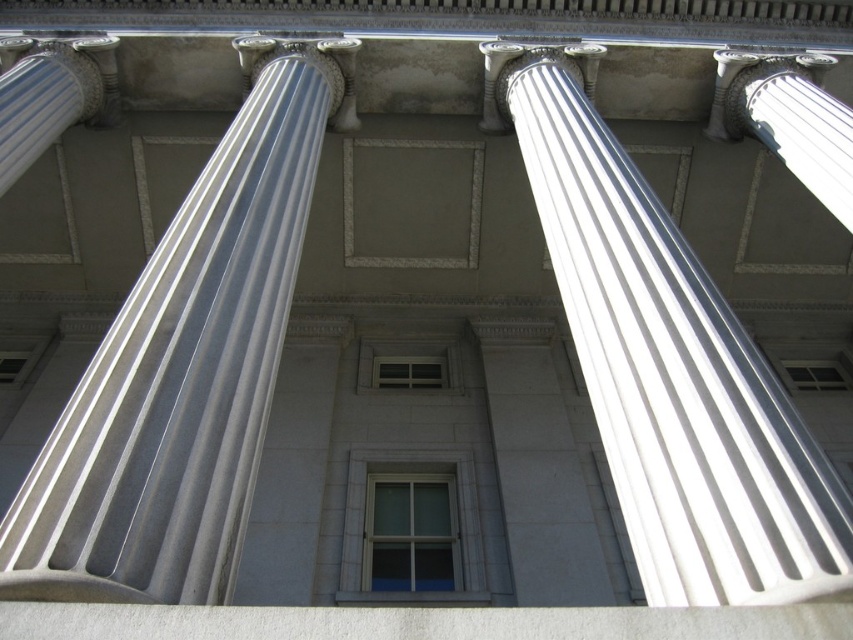
Question: Which object appears closest to the camera in this image?

Choices:
 (A) white glossy column at center
 (B) white marble column at upper right
 (C) white marble column at center

Answer: (A)

Question: Is white glossy column at center wider than white marble column at center?

Choices:
 (A) no
 (B) yes

Answer: (B)

Question: Which point is farther to the camera?

Choices:
 (A) (790, 132)
 (B) (648, 252)

Answer: (A)

Question: Does white marble column at center appear over white marble column at upper right?

Choices:
 (A) yes
 (B) no

Answer: (A)

Question: Is white marble column at center positioned behind white marble column at upper right?

Choices:
 (A) yes
 (B) no

Answer: (B)

Question: Among these points, which one is nearest to the camera?

Choices:
 (A) (271, 198)
 (B) (808, 156)

Answer: (A)